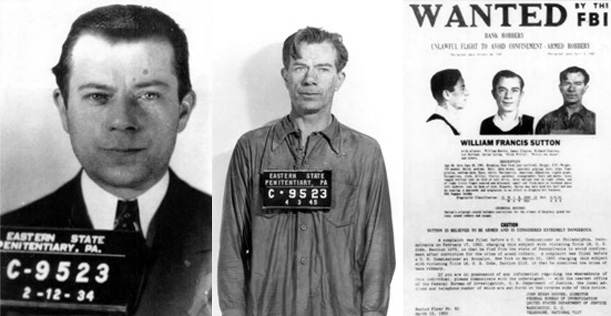
Find the location of `right ear of leftmost portrait`. right ear of leftmost portrait is located at coordinates (60, 105).